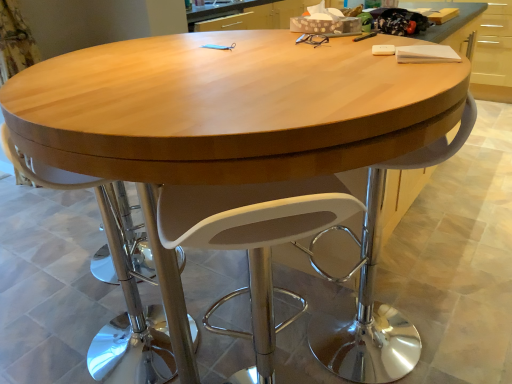
Question: Is white plastic swivel chair at center bigger or smaller than white plastic chair at center?

Choices:
 (A) small
 (B) big

Answer: (A)

Question: From the image's perspective, is white plastic swivel chair at center positioned above or below white plastic chair at center?

Choices:
 (A) above
 (B) below

Answer: (B)

Question: Would you say white plastic swivel chair at center is to the left or to the right of white plastic chair at center in the picture?

Choices:
 (A) left
 (B) right

Answer: (B)

Question: Considering the positions of white plastic chair at center and white plastic swivel chair at center in the image, is white plastic chair at center bigger or smaller than white plastic swivel chair at center?

Choices:
 (A) big
 (B) small

Answer: (A)

Question: Considering the positions of point (138, 266) and point (179, 233), is point (138, 266) closer or farther from the camera than point (179, 233)?

Choices:
 (A) farther
 (B) closer

Answer: (A)

Question: From the image's perspective, is white plastic chair at center positioned above or below white plastic swivel chair at center?

Choices:
 (A) below
 (B) above

Answer: (B)

Question: Do you think white plastic chair at center is within white plastic swivel chair at center, or outside of it?

Choices:
 (A) outside
 (B) inside

Answer: (A)